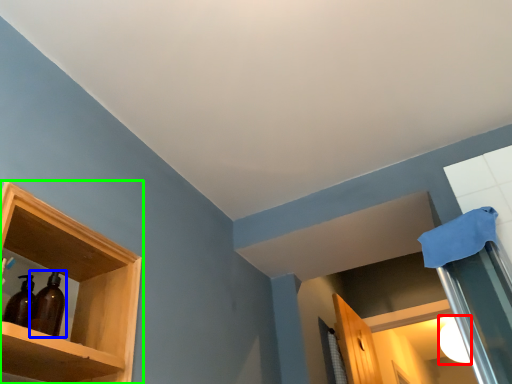
Question: Estimate the real-world distances between objects in this image. Which object is closer to lighting (highlighted by a red box), bottle (highlighted by a blue box) or shelf (highlighted by a green box)?

Choices:
 (A) bottle
 (B) shelf

Answer: (B)